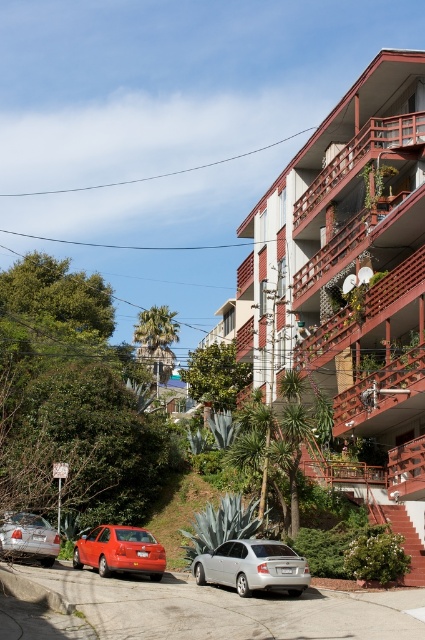
Question: Is silver metallic sedan at center closer to camera compared to shiny red sedan at lower left?

Choices:
 (A) yes
 (B) no

Answer: (A)

Question: Can you confirm if wooden balcony at upper right is wider than shiny red sedan at lower left?

Choices:
 (A) yes
 (B) no

Answer: (A)

Question: Estimate the real-world distances between objects in this image. Which object is closer to the wooden balcony at upper right?

Choices:
 (A) silver metallic sedan at lower left
 (B) silver metallic sedan at center

Answer: (B)

Question: Which point is farther to the camera?

Choices:
 (A) wooden balcony at upper right
 (B) shiny red sedan at lower left

Answer: (A)

Question: Is wooden balcony at upper right wider than shiny red sedan at lower left?

Choices:
 (A) no
 (B) yes

Answer: (B)

Question: Among these objects, which one is farthest from the camera?

Choices:
 (A) wooden balcony at upper right
 (B) silver metallic sedan at lower left

Answer: (A)